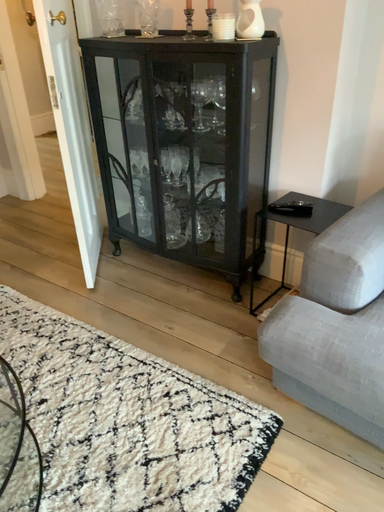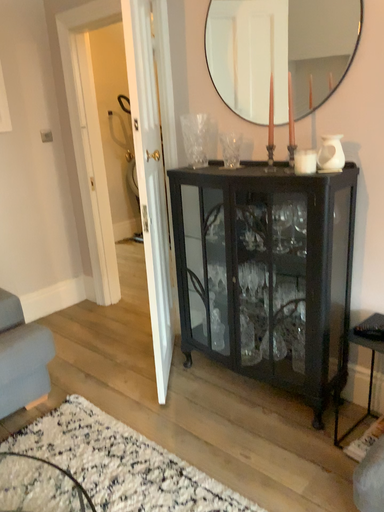
Question: Which way did the camera rotate in the video?

Choices:
 (A) rotated left
 (B) rotated right

Answer: (A)